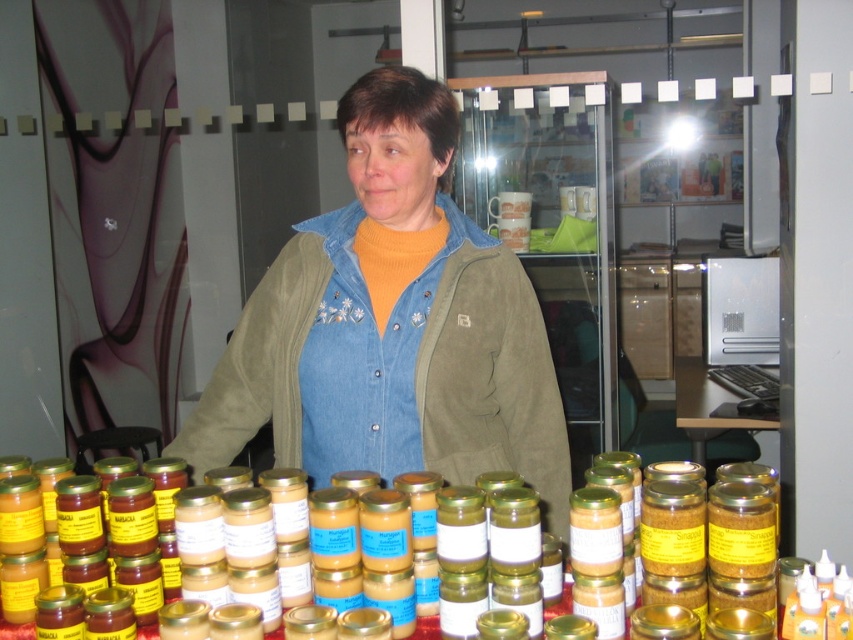
You are a customer at the market stall and want to pick up an item from the clear plastic table at center. However, there is a denim jacket at center in the way. Can you easily reach the table without moving the jacket?

The denim jacket at center is closer to the viewer than the clear plastic table at center, so the jacket is blocking direct access to the table. You would need to move the jacket or navigate around it to reach the table.